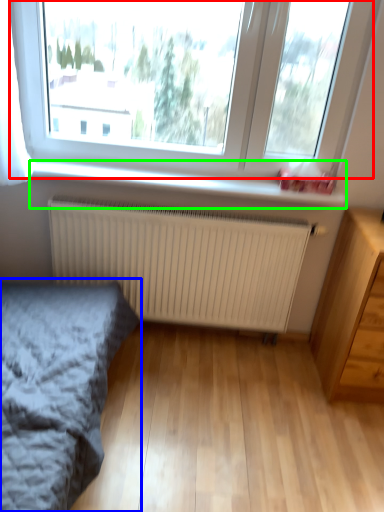
Question: Based on their relative distances, which object is nearer to window (highlighted by a red box)? Choose from bed (highlighted by a blue box) and window sill (highlighted by a green box).

Choices:
 (A) bed
 (B) window sill

Answer: (B)